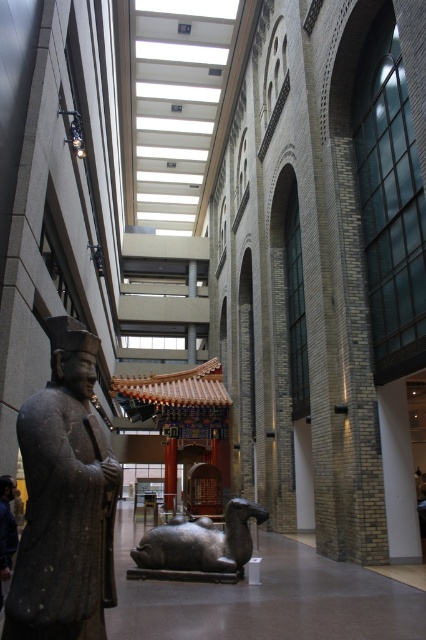
Consider the image. You are an art student visiting the museum. You want to take a photo of the matte gray statue at left without the polished bronze statue at center blocking the view. Is this possible given their positions?

The matte gray statue at left is in front of the polished bronze statue at center, so taking a photo of the matte gray statue at left without the polished bronze statue at center blocking the view is not possible because the matte gray statue is closer and would obscure the view of the polished bronze statue behind it.

You are standing in the museum and want to take a photo of the statue on the left and the camel sculpture in the center. You notice a specific point marked at coordinates point (39,529). If your camera has a maximum focus range of 7 meters, will you be able to focus on that point?

The distance of point (39,529) from the camera is 7.57 meters, which exceeds the camera maximum focus range of 7 meters. Therefore, you cannot focus on that point.

You are standing in the museum and want to take a photo of the matte gray statue at left. The camera you have can focus on objects up to 7 meters away. Will the statue be in focus?

The matte gray statue at left is 6.99 meters away from the camera, so it will be in focus since it is within the camera focus range of up to 7 meters.